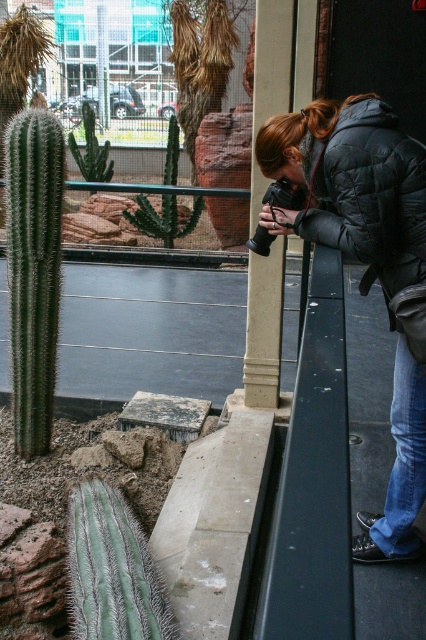
Question: Which of the following is the farthest from the observer?

Choices:
 (A) black quilted jacket at upper right
 (B) green matte cactus at left
 (C) green spiny cactus at center

Answer: (C)

Question: Considering the relative positions of black quilted jacket at upper right and green spiky cactus at center in the image provided, where is black quilted jacket at upper right located with respect to green spiky cactus at center?

Choices:
 (A) right
 (B) left

Answer: (A)

Question: Which object is the farthest from the green spiny cactus at center?

Choices:
 (A) black quilted jacket at upper right
 (B) green spiky cactus at center
 (C) green matte cactus at left

Answer: (A)

Question: Is green matte cactus at left to the left of green spiky cactus at center from the viewer's perspective?

Choices:
 (A) yes
 (B) no

Answer: (B)

Question: Which object is the closest to the black quilted jacket at upper right?

Choices:
 (A) green spiky cactus at center
 (B) green spiny cactus at center

Answer: (B)

Question: In this image, where is green matte cactus at left located relative to green spiny cactus at center?

Choices:
 (A) above
 (B) below

Answer: (B)